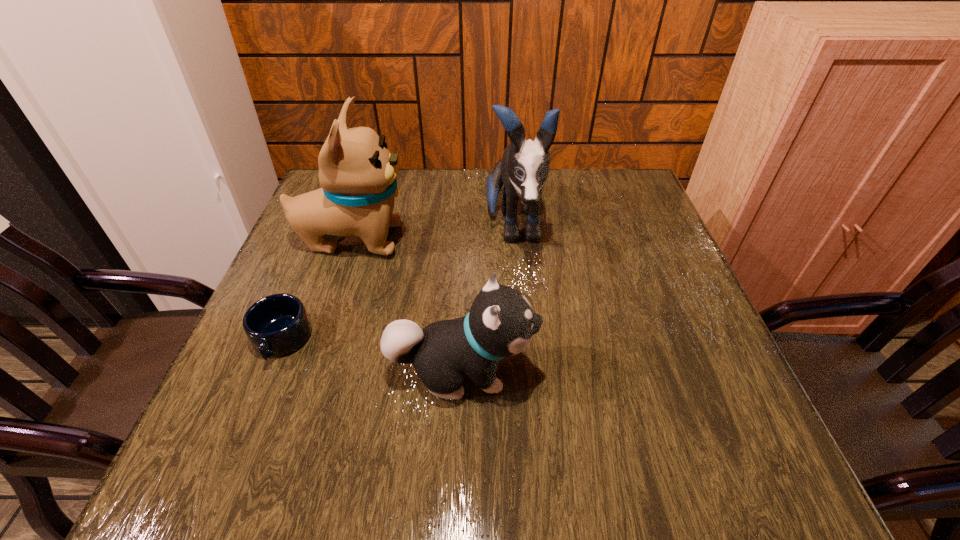
In order to click on object that stands as the closest to the leftmost puppy in this screenshot , I will do pos(276,325).

The height and width of the screenshot is (540, 960). What are the coordinates of `object that stands as the second closest to the leftmost puppy` in the screenshot? It's located at (524, 167).

Identify which puppy is the second closest to the third tallest object. Please provide its 2D coordinates. Your answer should be formatted as a tuple, i.e. [(x, y)], where the tuple contains the x and y coordinates of a point satisfying the conditions above.

[(357, 173)]

Select which puppy is the closest to the leftmost puppy. Please provide its 2D coordinates. Your answer should be formatted as a tuple, i.e. [(x, y)], where the tuple contains the x and y coordinates of a point satisfying the conditions above.

[(524, 167)]